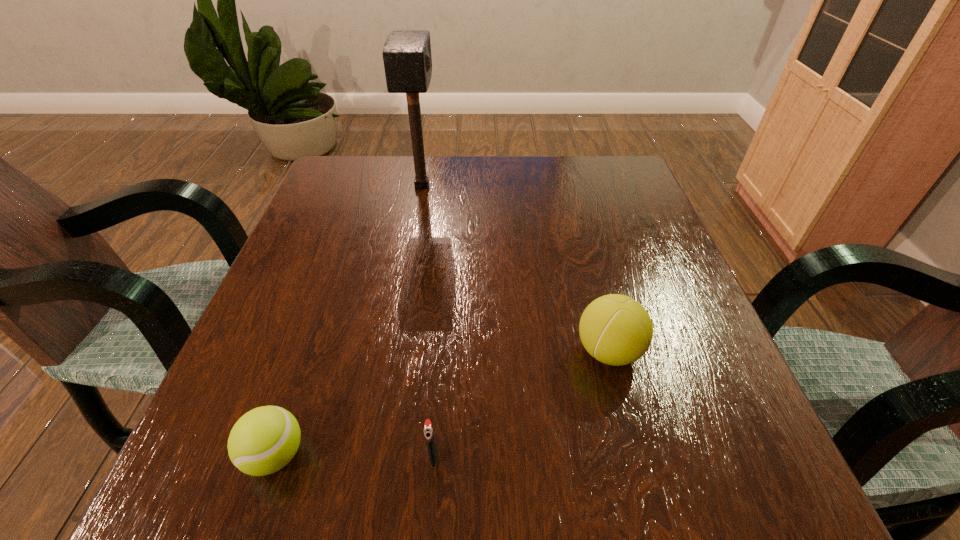
Identify the location of free region at the right edge of the desktop. This screenshot has width=960, height=540. (646, 300).

Find the location of `vacant region at the far left corner of the desktop`. vacant region at the far left corner of the desktop is located at coordinates (324, 197).

Image resolution: width=960 pixels, height=540 pixels. I want to click on vacant space at the far right corner of the desktop, so click(x=592, y=198).

Image resolution: width=960 pixels, height=540 pixels. I want to click on vacant space at the near right corner, so click(x=767, y=490).

This screenshot has height=540, width=960. Find the location of `free space that is in between the tallest object and the left tennis ball`. free space that is in between the tallest object and the left tennis ball is located at coordinates (348, 320).

Identify the location of empty space that is in between the igniter and the farthest object. The image size is (960, 540). pyautogui.click(x=427, y=321).

I want to click on vacant area that lies between the taller tennis ball and the farthest object, so click(x=516, y=268).

The height and width of the screenshot is (540, 960). What are the coordinates of `vacant region between the third nearest object and the third object from left to right` in the screenshot? It's located at (520, 404).

I want to click on unoccupied area between the third object from left to right and the third object from right to left, so [427, 321].

The image size is (960, 540). Identify the location of empty location between the second tallest object and the shorter tennis ball. [442, 403].